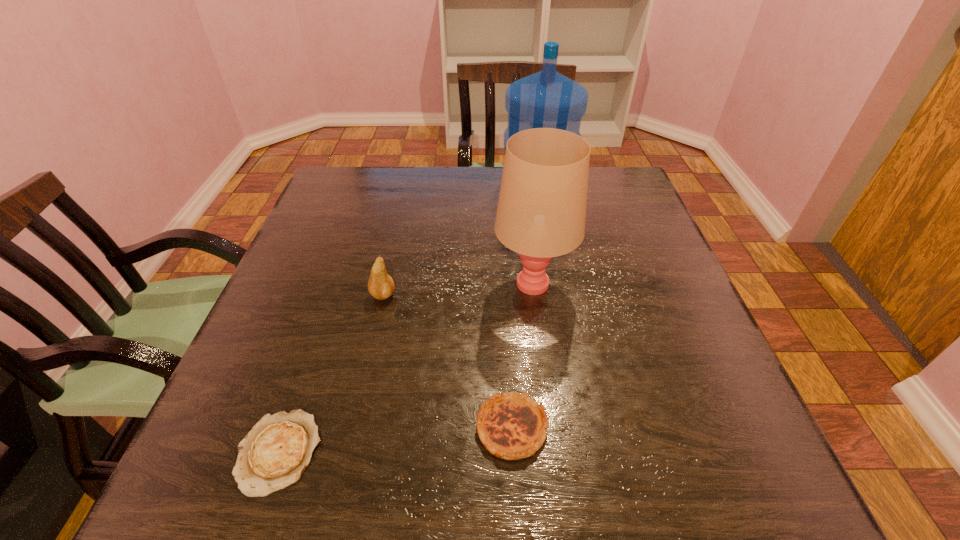
Locate which object ranks second in proximity to the fourth shortest object. Please provide its 2D coordinates. Your answer should be formatted as a tuple, i.e. [(x, y)], where the tuple contains the x and y coordinates of a point satisfying the conditions above.

[(381, 286)]

Choose which object is the second nearest neighbor to the pear. Please provide its 2D coordinates. Your answer should be formatted as a tuple, i.e. [(x, y)], where the tuple contains the x and y coordinates of a point satisfying the conditions above.

[(273, 455)]

The height and width of the screenshot is (540, 960). I want to click on vacant space that satisfies the following two spatial constraints: 1. on the back side of the leftmost object; 2. on the left side of the fourth tallest object, so click(x=288, y=428).